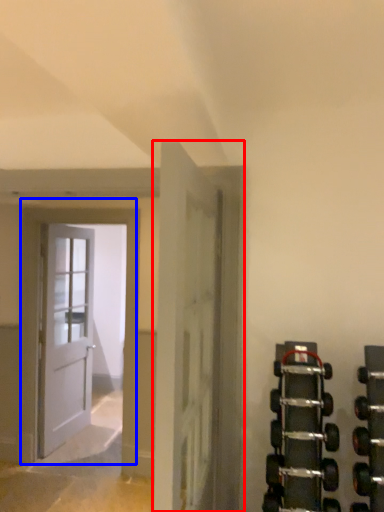
Question: Among these objects, which one is nearest to the camera, door (highlighted by a red box) or door (highlighted by a blue box)?

Choices:
 (A) door
 (B) door

Answer: (A)